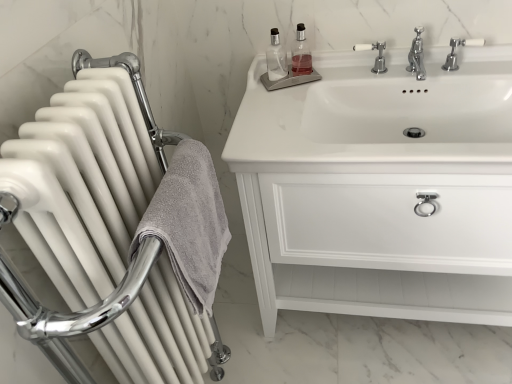
Question: Does point (252, 84) appear closer or farther from the camera than point (281, 72)?

Choices:
 (A) closer
 (B) farther

Answer: (A)

Question: Based on their positions, is white glossy cabinet at upper right located to the left or right of clear glass bottle at upper center?

Choices:
 (A) left
 (B) right

Answer: (B)

Question: Estimate the real-world distances between objects in this image. Which object is closer to the white glossy sink at upper right?

Choices:
 (A) white plastic tap at upper right, marked as the 2th tap in a left-to-right arrangement
 (B) clear glass soap dispenser at upper center
 (C) white glossy cabinet at upper right
 (D) gray textured towel at left
 (E) white glossy radiator at left

Answer: (C)

Question: Which of these objects is positioned closest to the clear glass bottle at upper center?

Choices:
 (A) white glossy sink at upper right
 (B) clear glass soap dispenser at upper center
 (C) white ceramic tap at upper center, which appears as the second tap when viewed from the right
 (D) white glossy radiator at left
 (E) white plastic tap at upper right, arranged as the 1th tap when viewed from the right

Answer: (B)